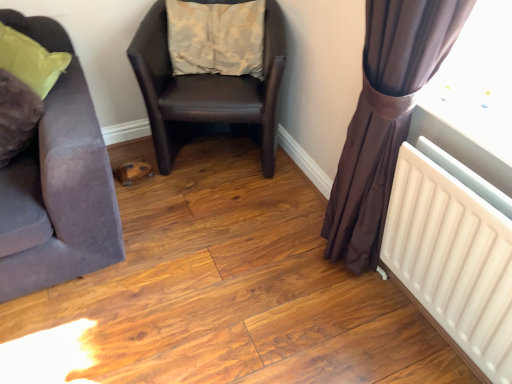
Question: Can you confirm if suede-like brown chair at left, placed as the 1th chair when sorted from left to right, is taller than brown sheer curtain at right?

Choices:
 (A) no
 (B) yes

Answer: (A)

Question: Does suede-like brown chair at left, which is the 2th chair from right to left, have a lesser width compared to brown sheer curtain at right?

Choices:
 (A) no
 (B) yes

Answer: (A)

Question: Is the surface of suede-like brown chair at left, which is the 2th chair from right to left, in direct contact with brown sheer curtain at right?

Choices:
 (A) no
 (B) yes

Answer: (A)

Question: Is brown sheer curtain at right inside suede-like brown chair at left, placed as the 1th chair when sorted from left to right?

Choices:
 (A) no
 (B) yes

Answer: (A)

Question: Is suede-like brown chair at left, placed as the 1th chair when sorted from left to right, wider than brown sheer curtain at right?

Choices:
 (A) no
 (B) yes

Answer: (B)

Question: From the image's perspective, is suede-like brown chair at left, which is the 2th chair from right to left, on top of brown sheer curtain at right?

Choices:
 (A) yes
 (B) no

Answer: (A)

Question: From a real-world perspective, does suede-like brown chair at left, which is the 2th chair from right to left, stand above white plastic radiator at lower right?

Choices:
 (A) yes
 (B) no

Answer: (A)

Question: Can you confirm if suede-like brown chair at left, placed as the 1th chair when sorted from left to right, is smaller than white plastic radiator at lower right?

Choices:
 (A) no
 (B) yes

Answer: (A)

Question: Is suede-like brown chair at left, placed as the 1th chair when sorted from left to right, in contact with white plastic radiator at lower right?

Choices:
 (A) no
 (B) yes

Answer: (A)

Question: Considering the relative sizes of suede-like brown chair at left, placed as the 1th chair when sorted from left to right, and white plastic radiator at lower right in the image provided, is suede-like brown chair at left, placed as the 1th chair when sorted from left to right, thinner than white plastic radiator at lower right?

Choices:
 (A) no
 (B) yes

Answer: (A)

Question: Would you consider suede-like brown chair at left, placed as the 1th chair when sorted from left to right, to be distant from white plastic radiator at lower right?

Choices:
 (A) no
 (B) yes

Answer: (B)

Question: Is suede-like brown chair at left, placed as the 1th chair when sorted from left to right, not within white plastic radiator at lower right?

Choices:
 (A) no
 (B) yes

Answer: (B)

Question: Can you confirm if beige fabric pillow at center is bigger than brown sheer curtain at right?

Choices:
 (A) yes
 (B) no

Answer: (B)